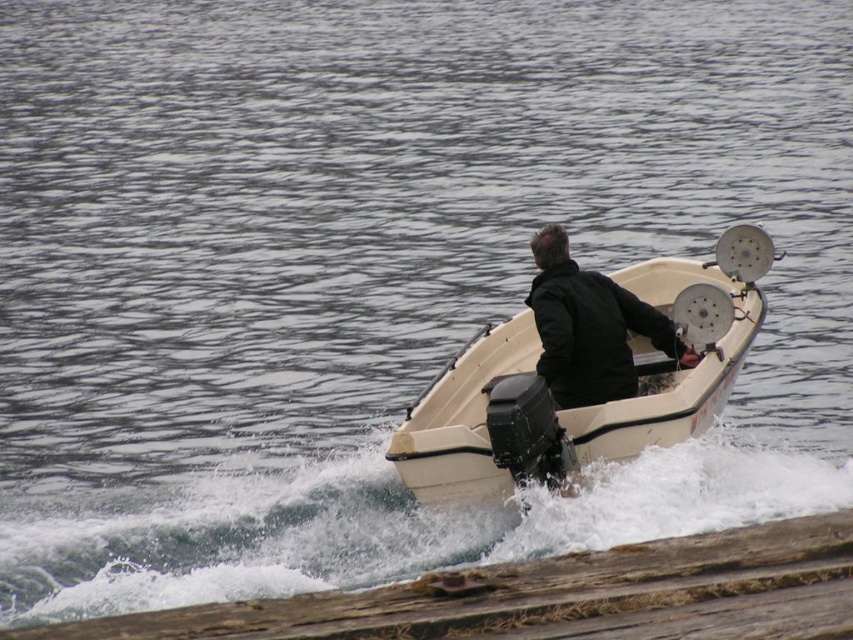
You are a passenger on the white plastic boat at center and need to reach the wooden log at lower center. Is the boat currently above or below the log?

The white plastic boat at center is positioned over wooden log at lower center, so the boat is currently above the log.

You are standing on the wooden log at lower center and want to climb onto the white plastic boat at center. Based on the scene description, is the boat higher or lower than the log? Explain your reasoning.

The white plastic boat at center is much taller than the wooden log at lower center, so the boat is higher than the log. This means you would need to climb upwards to reach it from the log.